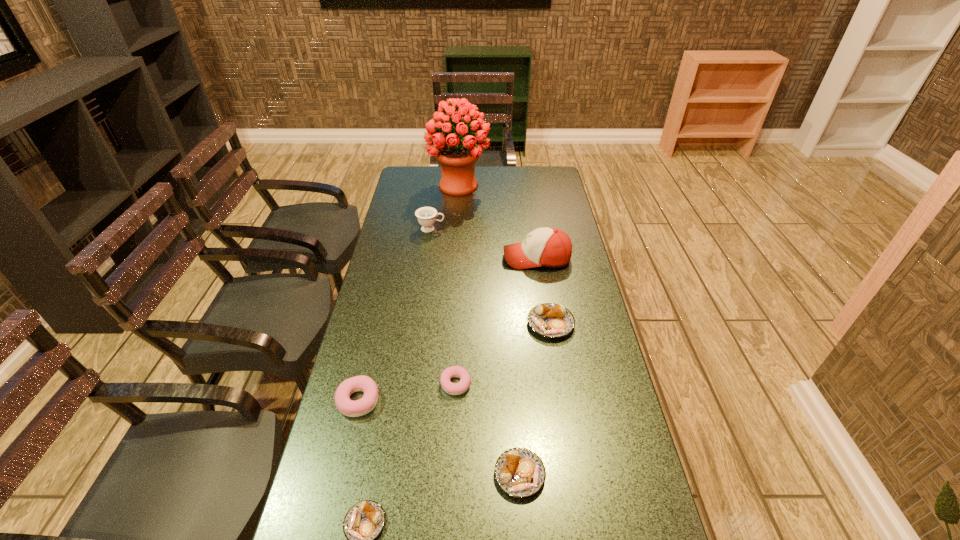
I want to click on free spot that satisfies the following two spatial constraints: 1. on the front-facing side of the baseball cap; 2. on the front side of the seventh farthest object, so click(570, 475).